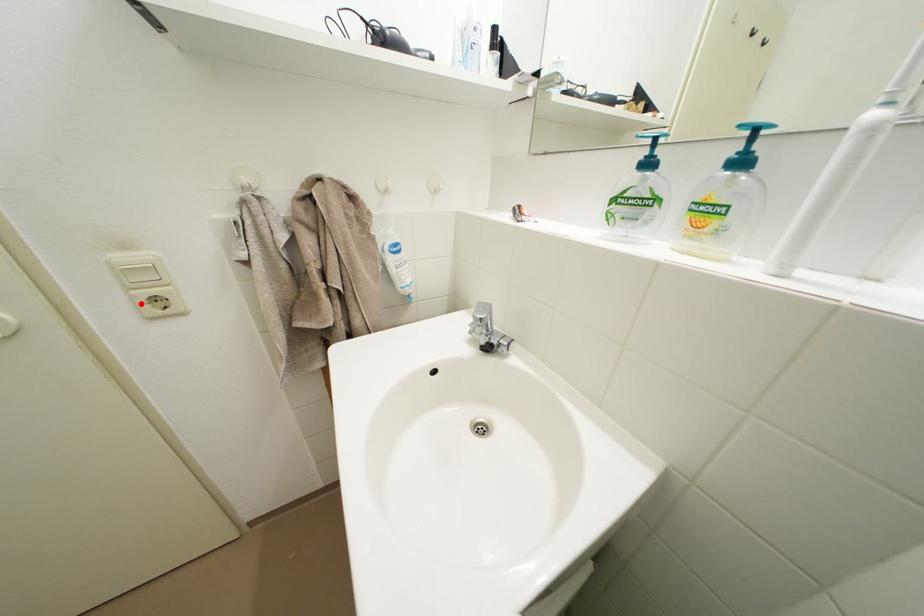
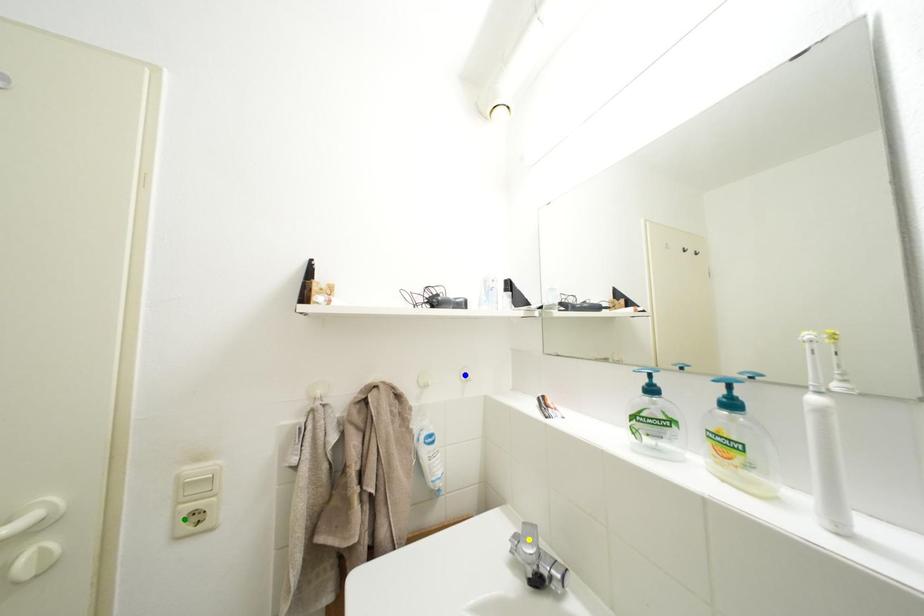
Question: I am providing you with two images of the same scene from different viewpoints. A red point is marked on the first image. You are given multiple points on the second image. Which mark in image 2 goes with the point in image 1?

Choices:
 (A) yellow point
 (B) blue point
 (C) green point

Answer: (C)